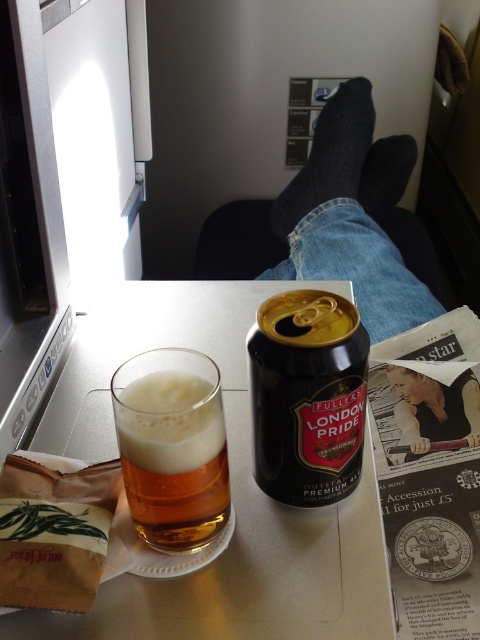
Question: Considering the real-world distances, which object is farthest from the amber glass at left?

Choices:
 (A) smooth skin at upper center
 (B) dark gray socks at upper center
 (C) translucent plastic tray at center
 (D) black matte can at center

Answer: (B)

Question: Among these objects, which one is farthest from the camera?

Choices:
 (A) dark gray socks at upper center
 (B) smooth skin at upper center
 (C) amber glass at left

Answer: (A)

Question: Which of the following is the farthest from the observer?

Choices:
 (A) dark gray socks at upper center
 (B) black matte can at center
 (C) translucent plastic tray at center

Answer: (A)

Question: Is the position of translucent plastic tray at center less distant than that of amber glass at left?

Choices:
 (A) no
 (B) yes

Answer: (A)

Question: Can you confirm if amber glass at left is bigger than smooth skin at upper center?

Choices:
 (A) no
 (B) yes

Answer: (A)

Question: Observing the image, what is the correct spatial positioning of dark gray socks at upper center in reference to black matte can at center?

Choices:
 (A) left
 (B) right

Answer: (B)